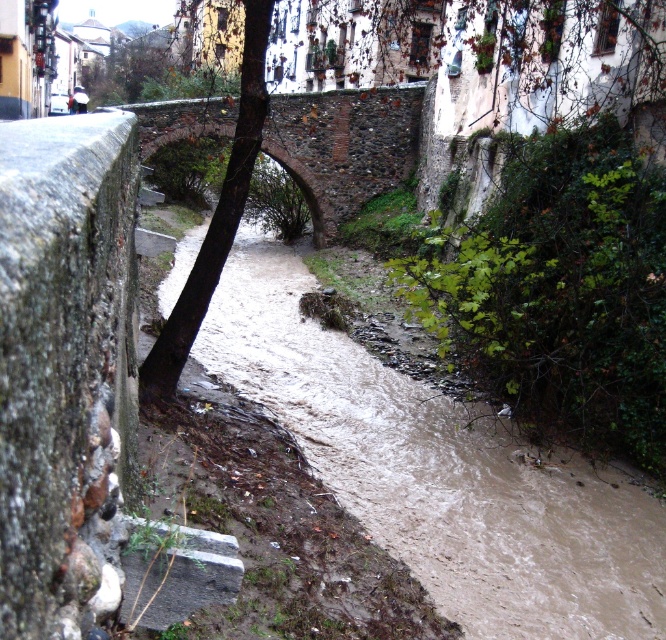
Question: Which object is farther from the camera taking this photo?

Choices:
 (A) brown rough tree trunk at center
 (B) stone arch bridge at center

Answer: (B)

Question: In this image, where is stone arch bridge at center located relative to brown rough tree trunk at center?

Choices:
 (A) above
 (B) below

Answer: (A)

Question: Is stone arch bridge at center positioned in front of brown rough tree trunk at center?

Choices:
 (A) no
 (B) yes

Answer: (A)

Question: Can you confirm if stone arch bridge at center is thinner than brown rough tree trunk at center?

Choices:
 (A) yes
 (B) no

Answer: (B)